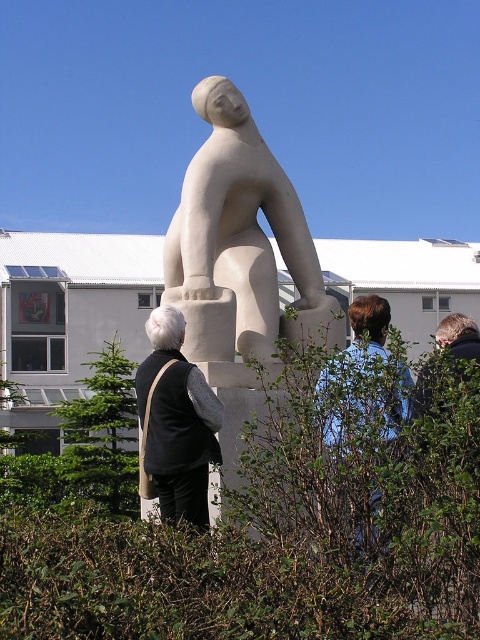
Does white stone statue at center have a lesser width compared to black fabric vest at center?

No.

How far apart are white stone statue at center and black fabric vest at center?

white stone statue at center is 7.34 meters away from black fabric vest at center.

Is point (237, 264) positioned behind point (197, 390)?

Yes, point (237, 264) is farther from viewer.

Find the location of a particular element. Image resolution: width=480 pixels, height=640 pixels. white stone statue at center is located at coordinates (240, 225).

Does white stone statue at center have a lesser height compared to green leafy bush at lower left?

In fact, white stone statue at center may be taller than green leafy bush at lower left.

Which is more to the right, white stone statue at center or green leafy bush at lower left?

From the viewer's perspective, white stone statue at center appears more on the right side.

Where is `white stone statue at center`? white stone statue at center is located at coordinates (240, 225).

Find the location of a particular element. The height and width of the screenshot is (640, 480). white stone statue at center is located at coordinates (240, 225).

Who is higher up, green leafy hedge at center or white stone statue at center?

white stone statue at center is above.

Who is lower down, green leafy hedge at center or white stone statue at center?

Positioned lower is green leafy hedge at center.

At what (x,y) coordinates should I click in order to perform the action: click on green leafy hedge at center. Please return your answer as a coordinate pair (x, y). Looking at the image, I should click on click(286, 524).